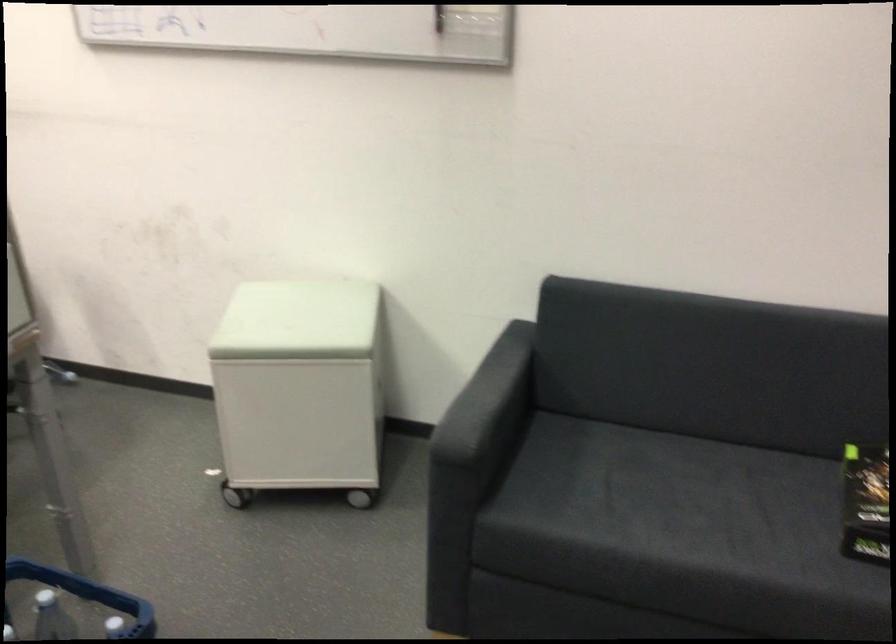
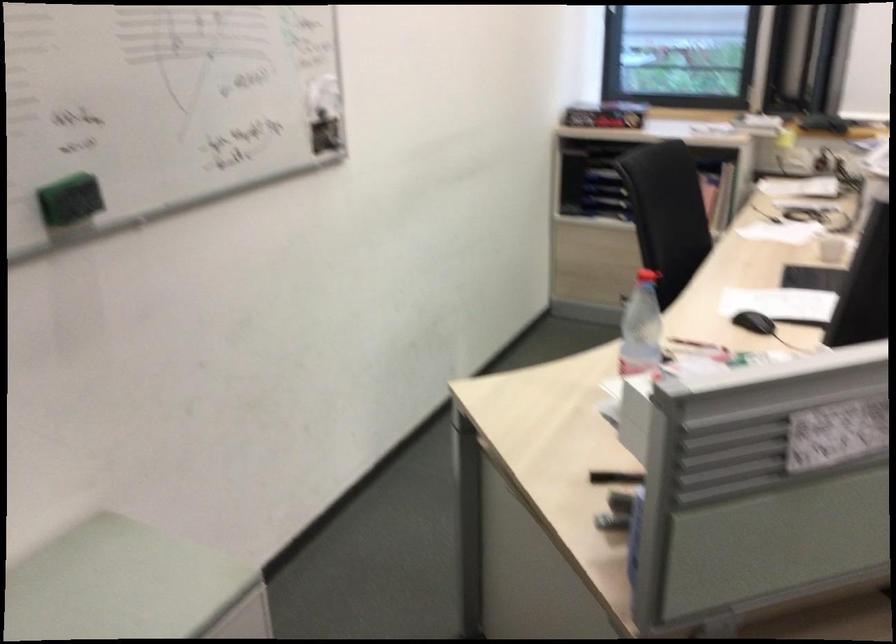
Based on the continuous images, in which direction is the camera rotating?

The rotation direction of the camera is left-down.